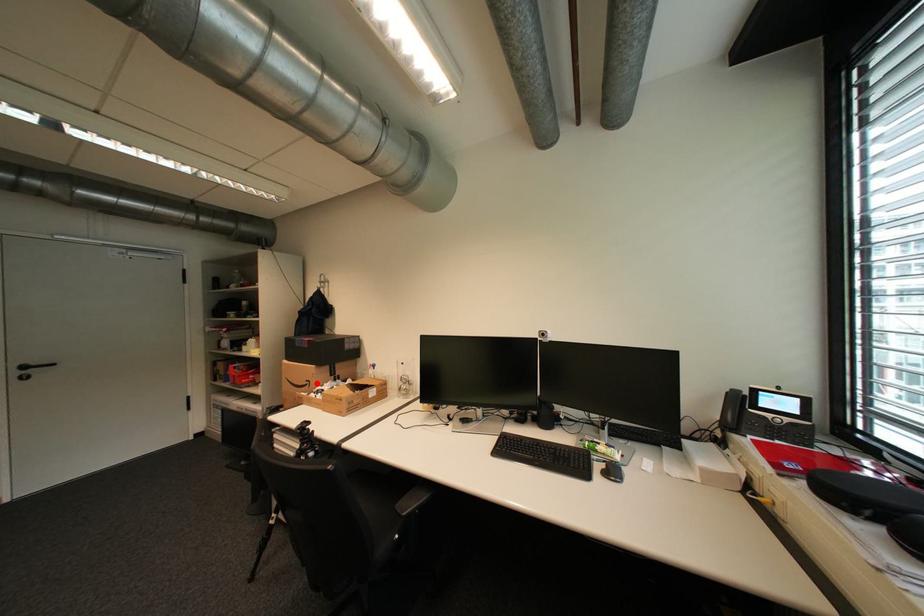
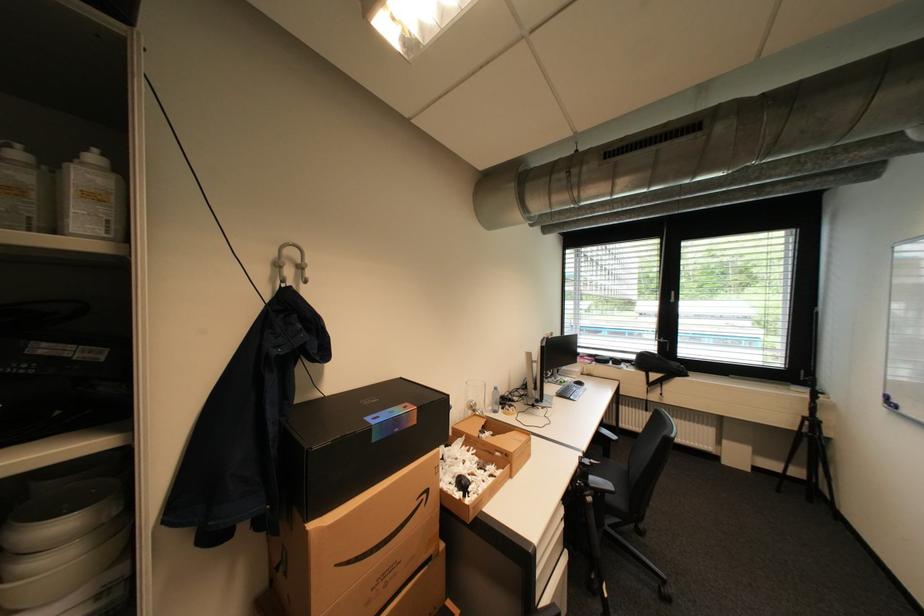
Question: I am providing you with two images of the same scene from different viewpoints. A red point is marked on the first image. Can you still see the location of the red point in image 2?

Choices:
 (A) Yes
 (B) No

Answer: (A)